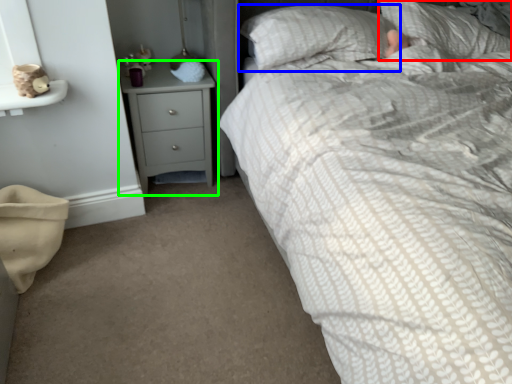
Question: Which is nearer to the pillow (highlighted by a red box)? pillow (highlighted by a blue box) or chest of drawers (highlighted by a green box).

Choices:
 (A) pillow
 (B) chest of drawers

Answer: (A)